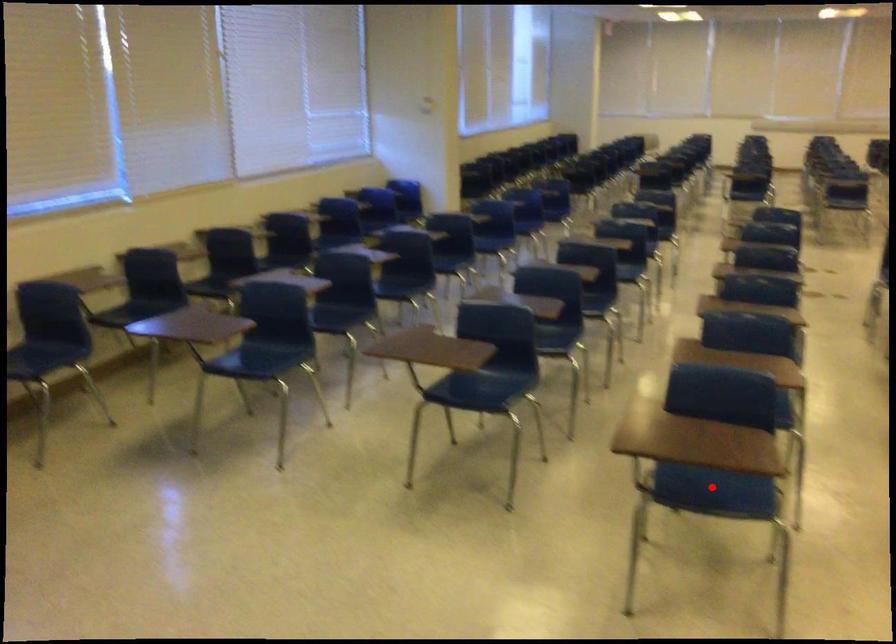
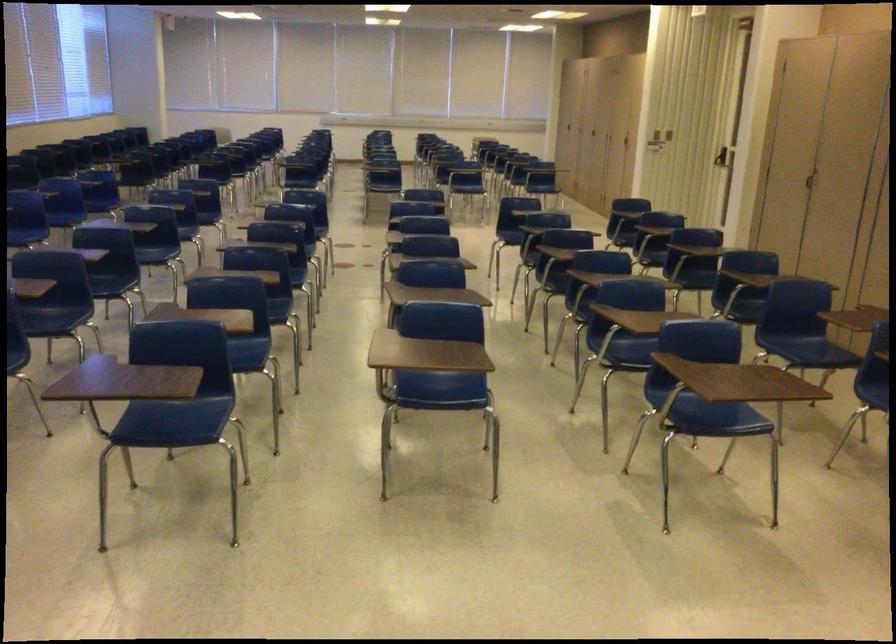
In the second image, find the point that corresponds to the highlighted location in the first image.

(173, 422)